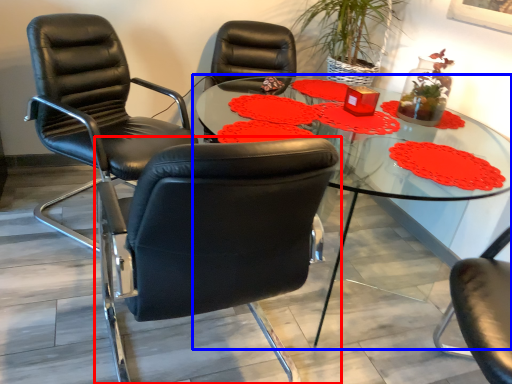
Question: Which point is closer to the camera, chair (highlighted by a red box) or table (highlighted by a blue box)?

Choices:
 (A) chair
 (B) table

Answer: (A)